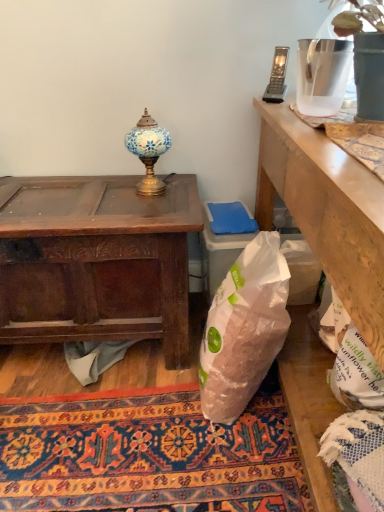
Find the location of a particular element. translucent plastic vase at upper right is located at coordinates (366, 57).

What are the coordinates of `gray fabric at lower center` in the screenshot? It's located at (94, 358).

What do you see at coordinates (94, 358) in the screenshot?
I see `gray fabric at lower center` at bounding box center [94, 358].

The height and width of the screenshot is (512, 384). What are the coordinates of `translucent plastic bag at center` in the screenshot? It's located at (244, 329).

What is the approximate width of clear plastic pitcher at upper right?

clear plastic pitcher at upper right is 5.18 inches in width.

Measure the distance between mosaic glass lamp at upper center and camera.

mosaic glass lamp at upper center and camera are 1.39 meters apart from each other.

Where is `translucent plastic vase at upper right`? The image size is (384, 512). translucent plastic vase at upper right is located at coordinates (366, 57).

Which point is more forward, (149, 189) or (72, 253)?

The point (72, 253) is in front.

From a real-world perspective, which object stands above the other?

From a 3D spatial view, mosaic glass lamp at upper center is above.

Looking at their sizes, would you say mosaic glass lamp at upper center is wider or thinner than dark brown wood desk at left?

Clearly, mosaic glass lamp at upper center has less width compared to dark brown wood desk at left.

Is mosaic glass lamp at upper center aimed at dark brown wood desk at left?

No, mosaic glass lamp at upper center is not aimed at dark brown wood desk at left.

Does dark brown wood desk at left have a lesser width compared to translucent plastic bag at center?

In fact, dark brown wood desk at left might be wider than translucent plastic bag at center.

From a real-world perspective, between dark brown wood desk at left and translucent plastic bag at center, who is vertically lower?

translucent plastic bag at center.

Considering the points (366, 86) and (341, 95), which point is in front, point (366, 86) or point (341, 95)?

The point (366, 86) is more forward.

Can you confirm if translucent plastic vase at upper right is positioned to the right of clear plastic pitcher at upper right?

Correct, you'll find translucent plastic vase at upper right to the right of clear plastic pitcher at upper right.

Considering the sizes of objects translucent plastic vase at upper right and clear plastic pitcher at upper right in the image provided, who is taller, translucent plastic vase at upper right or clear plastic pitcher at upper right?

Standing taller between the two is translucent plastic vase at upper right.

Locate an element on the screen. This screenshot has height=512, width=384. vase lying on the left of translucent plastic vase at upper right is located at coordinates (322, 75).

Considering the sizes of objects dark brown wood desk at left and carpeted rug at center in the image provided, who is wider, dark brown wood desk at left or carpeted rug at center?

carpeted rug at center is wider.

Is dark brown wood desk at left in contact with carpeted rug at center?

No.

Is point (19, 283) closer to camera compared to point (226, 434)?

No, it is behind (226, 434).

Is carpeted rug at center inside the boundaries of mosaic glass lamp at upper center, or outside?

carpeted rug at center exists outside the volume of mosaic glass lamp at upper center.

Which object is more forward, carpeted rug at center or mosaic glass lamp at upper center?

carpeted rug at center.

From a real-world perspective, is carpeted rug at center physically located above or below mosaic glass lamp at upper center?

From a real-world perspective, carpeted rug at center is physically below mosaic glass lamp at upper center.

From a real-world perspective, is translucent plastic bag at center over mosaic glass lamp at upper center?

No, from a real-world perspective, translucent plastic bag at center is not over mosaic glass lamp at upper center

The image size is (384, 512). What are the coordinates of `plastic bag that appears below the mosaic glass lamp at upper center (from the image's perspective)` in the screenshot? It's located at (244, 329).

Between translucent plastic bag at center and mosaic glass lamp at upper center, which one has smaller width?

mosaic glass lamp at upper center is thinner.

From the image's perspective, between translucent plastic bag at center and mosaic glass lamp at upper center, who is located below?

translucent plastic bag at center appears lower in the image.

Is gray plastic phone at upper right positioned beyond the bounds of clear plastic pitcher at upper right?

Absolutely, gray plastic phone at upper right is external to clear plastic pitcher at upper right.

Is the position of gray plastic phone at upper right less distant than that of clear plastic pitcher at upper right?

No, it is not.

From a real-world perspective, is gray plastic phone at upper right above or below clear plastic pitcher at upper right?

From a real-world perspective, gray plastic phone at upper right is physically below clear plastic pitcher at upper right.

Locate an element on the screen. The width and height of the screenshot is (384, 512). desk below the mosaic glass lamp at upper center (from a real-world perspective) is located at coordinates (96, 261).

This screenshot has height=512, width=384. I want to click on plastic bag below the dark brown wood desk at left (from the image's perspective), so click(244, 329).

Looking at the image, which one is located closer to gray plastic phone at upper right, translucent plastic vase at upper right or mosaic glass lamp at upper center?

mosaic glass lamp at upper center is positioned closer to the anchor gray plastic phone at upper right.

Looking at the image, which one is located closer to translucent plastic vase at upper right, gray fabric at lower center or translucent plastic bag at center?

translucent plastic bag at center is positioned closer to the anchor translucent plastic vase at upper right.

Based on their spatial positions, is clear plastic pitcher at upper right or carpeted rug at center closer to dark brown wood desk at left?

carpeted rug at center is closer to dark brown wood desk at left.

Considering their positions, is gray fabric at lower center positioned closer to translucent plastic vase at upper right than clear plastic pitcher at upper right?

The object closer to translucent plastic vase at upper right is clear plastic pitcher at upper right.

Based on their spatial positions, is gray fabric at lower center or mosaic glass lamp at upper center further from translucent plastic bag at center?

mosaic glass lamp at upper center.

From the image, which object appears to be farther from gray fabric at lower center, translucent plastic vase at upper right or translucent plastic bag at center?

translucent plastic vase at upper right is further to gray fabric at lower center.

Considering their positions, is translucent plastic bag at center positioned further to dark brown wood desk at left than gray fabric at lower center?

gray fabric at lower center is further to dark brown wood desk at left.

Based on their spatial positions, is mosaic glass lamp at upper center or dark brown wood desk at left further from carpeted rug at center?

mosaic glass lamp at upper center is further to carpeted rug at center.

Locate an element on the screen. The height and width of the screenshot is (512, 384). material between translucent plastic vase at upper right and carpeted rug at center in the up-down direction is located at coordinates point(94,358).

Find the location of a particular element. The height and width of the screenshot is (512, 384). lamp that lies between clear plastic pitcher at upper right and carpeted rug at center from top to bottom is located at coordinates (148, 151).

Image resolution: width=384 pixels, height=512 pixels. In order to click on mat between gray fabric at lower center and translucent plastic bag at center in this screenshot , I will do `click(148, 454)`.

The height and width of the screenshot is (512, 384). What are the coordinates of `lamp between translucent plastic vase at upper right and gray fabric at lower center in the vertical direction` in the screenshot? It's located at (148, 151).